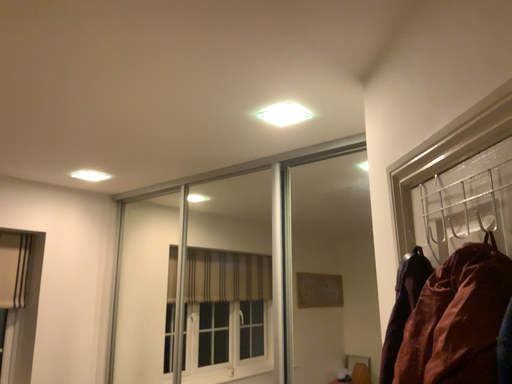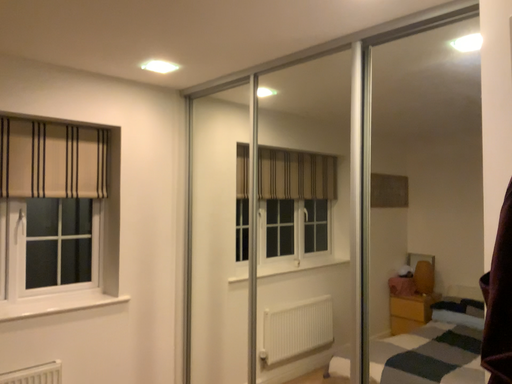
Question: How did the camera likely rotate when shooting the video?

Choices:
 (A) rotated right
 (B) rotated left

Answer: (B)